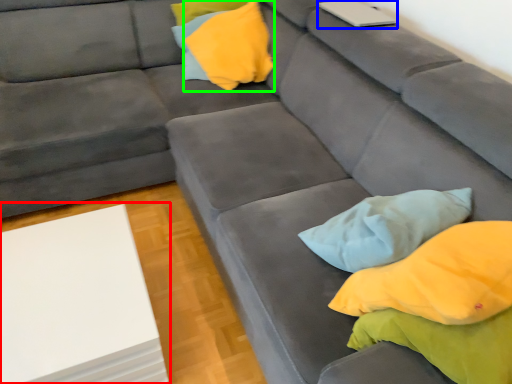
Question: Which object is the closest to the table (highlighted by a red box)? Choose among these: laptop (highlighted by a blue box) or pillow (highlighted by a green box).

Choices:
 (A) laptop
 (B) pillow

Answer: (B)